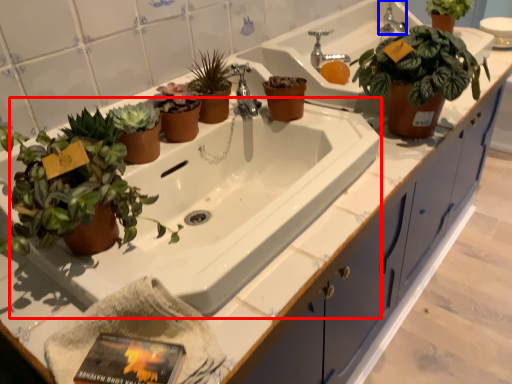
Question: Which object is closer to the camera taking this photo, bath (highlighted by a red box) or faucet (highlighted by a blue box)?

Choices:
 (A) bath
 (B) faucet

Answer: (A)